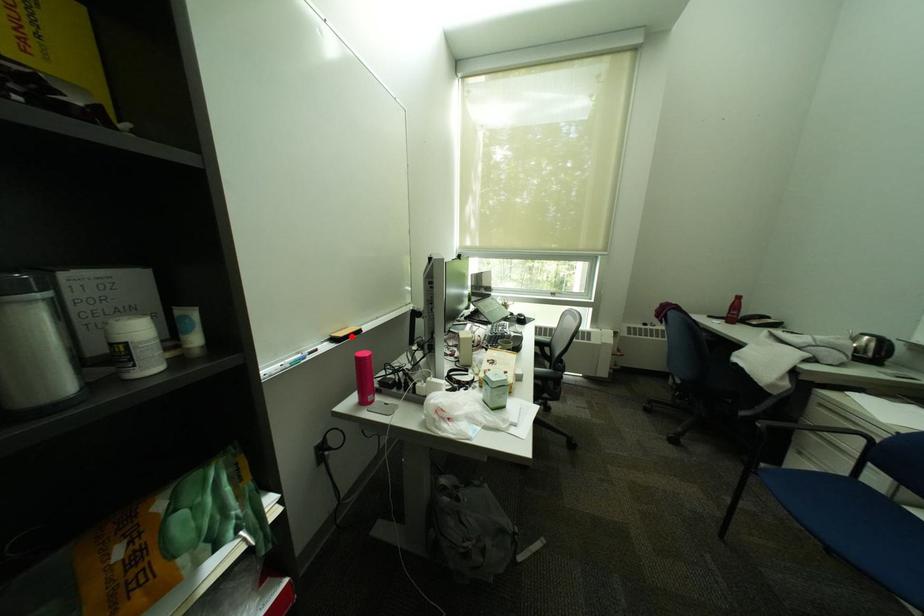
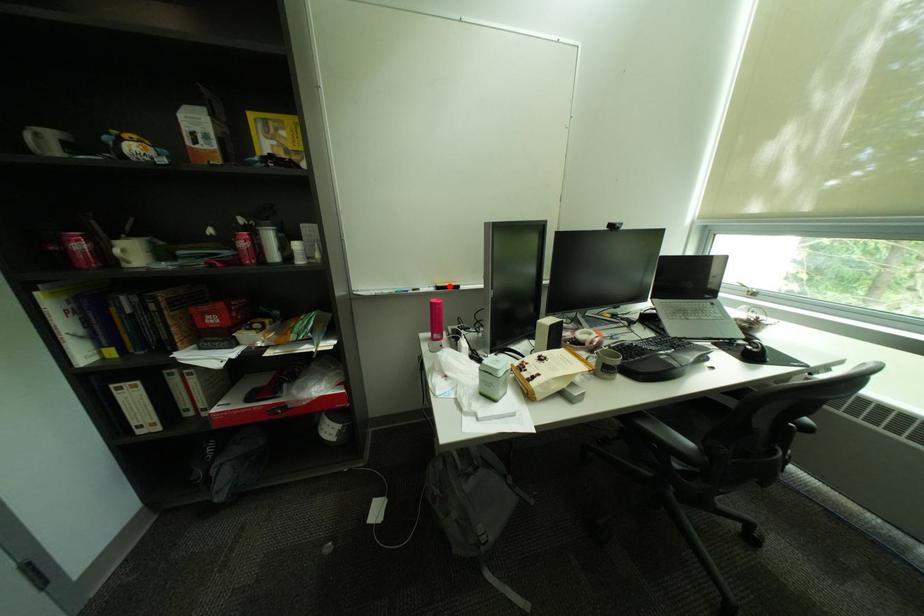
I am providing you with two images of the same scene from different viewpoints. A red point is marked on the first image and another point is marked on the second image. Do the highlighted points in image1 and image2 indicate the same real-world spot?

Yes